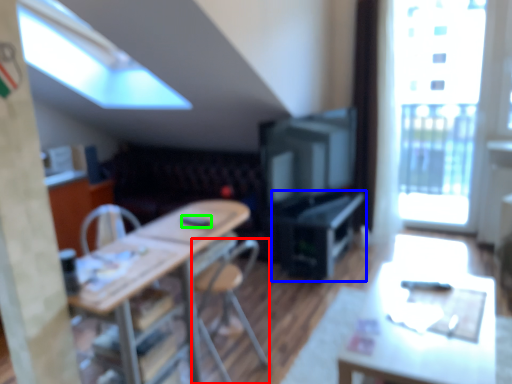
Question: Considering the real-world distances, which object is farthest from chair (highlighted by a red box)? computer desk (highlighted by a blue box) or remote control (highlighted by a green box)?

Choices:
 (A) computer desk
 (B) remote control

Answer: (A)